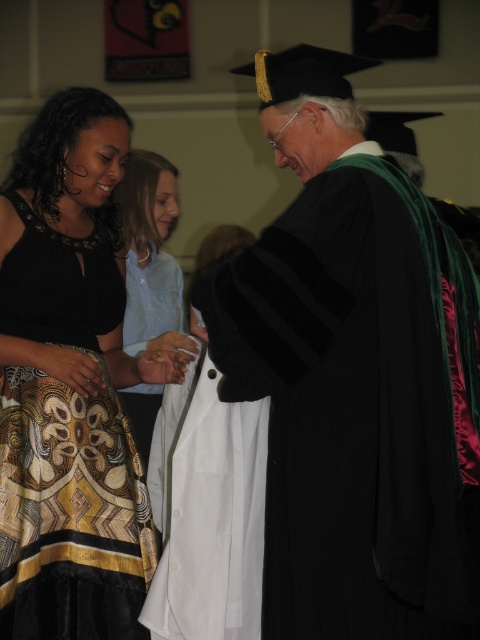
Question: Does matte black graduation gown at center have a lesser width compared to light blue shirt at center?

Choices:
 (A) yes
 (B) no

Answer: (B)

Question: Estimate the real-world distances between objects in this image. Which object is farther from the light blue shirt at center?

Choices:
 (A) matte black graduation gown at center
 (B) patterned fabric dress at lower left

Answer: (A)

Question: Which object is positioned farthest from the light blue shirt at center?

Choices:
 (A) patterned fabric dress at lower left
 (B) matte black graduation gown at center

Answer: (B)

Question: Observing the image, what is the correct spatial positioning of patterned fabric dress at lower left in reference to light blue shirt at center?

Choices:
 (A) above
 (B) below

Answer: (B)

Question: Which of the following is the closest to the observer?

Choices:
 (A) matte black graduation gown at center
 (B) light blue shirt at center
 (C) patterned fabric dress at lower left

Answer: (A)

Question: Does matte black graduation gown at center appear under patterned fabric dress at lower left?

Choices:
 (A) no
 (B) yes

Answer: (A)